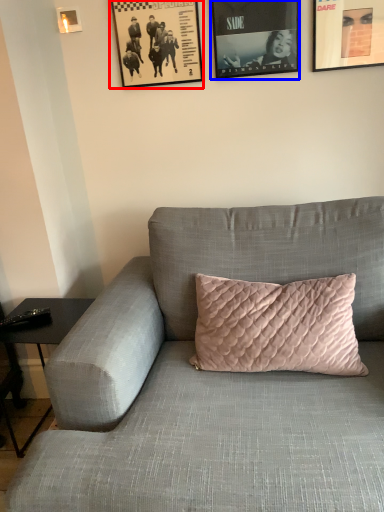
Question: Among these objects, which one is farthest to the camera, picture frame (highlighted by a red box) or picture frame (highlighted by a blue box)?

Choices:
 (A) picture frame
 (B) picture frame

Answer: (A)